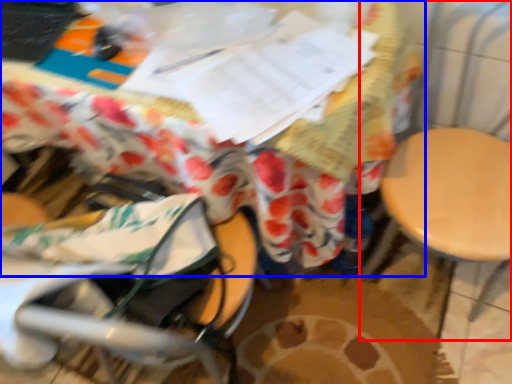
Question: Which point is closer to the camera, swivel chair (highlighted by a red box) or table (highlighted by a blue box)?

Choices:
 (A) swivel chair
 (B) table

Answer: (A)